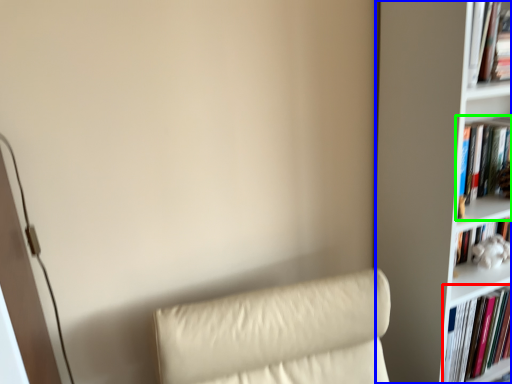
Question: Which object is positioned farthest from book (highlighted by a red box)? Select from bookcase (highlighted by a blue box) and book (highlighted by a green box).

Choices:
 (A) bookcase
 (B) book

Answer: (B)